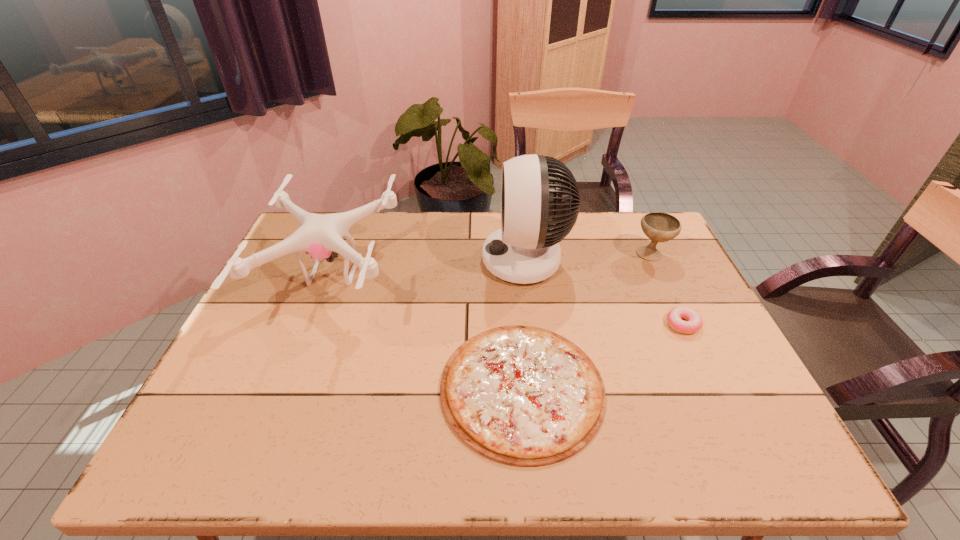
Find the location of a particular element. Image resolution: width=960 pixels, height=540 pixels. vacant area situated on the front of the chalice is located at coordinates (685, 325).

This screenshot has width=960, height=540. I want to click on free space located on the front of the second shortest object, so click(731, 426).

Where is `vacant space located 0.400m on the back of the pizza`? The image size is (960, 540). vacant space located 0.400m on the back of the pizza is located at coordinates (509, 237).

Where is `fan that is at the far edge`? This screenshot has width=960, height=540. fan that is at the far edge is located at coordinates (538, 211).

I want to click on drone located at the far edge, so click(x=320, y=235).

Locate an element on the screen. This screenshot has width=960, height=540. chalice that is at the far edge is located at coordinates (659, 227).

Image resolution: width=960 pixels, height=540 pixels. I want to click on object present at the near edge, so click(x=524, y=396).

Locate an element on the screen. object present at the left edge is located at coordinates (320, 235).

Where is `chalice that is positioned at the right edge`? This screenshot has height=540, width=960. chalice that is positioned at the right edge is located at coordinates (659, 227).

The height and width of the screenshot is (540, 960). What are the coordinates of `doughnut located at the right edge` in the screenshot? It's located at (694, 322).